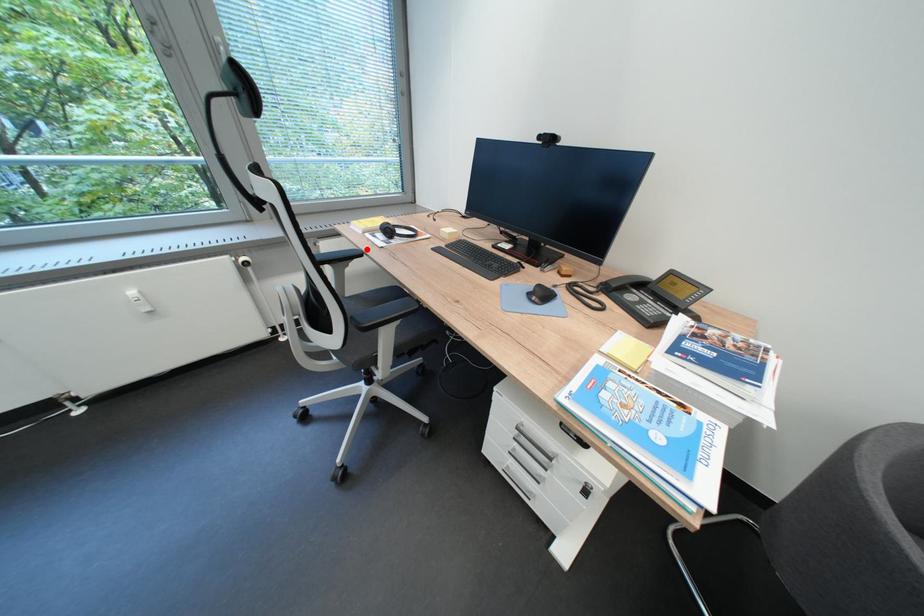
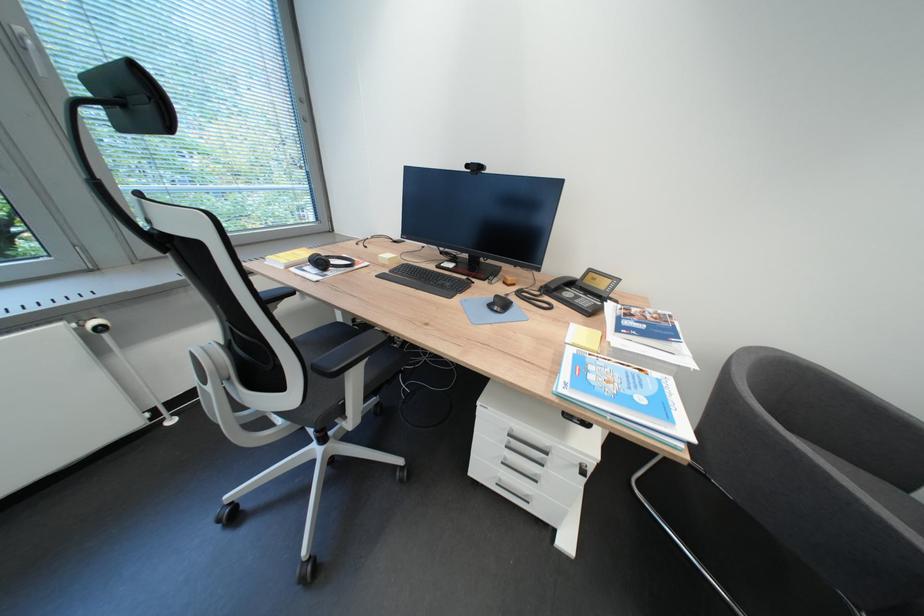
Question: I am providing you with two images of the same scene from different viewpoints. A red point is marked on the first image. At the location where the point appears in image 1, is it still visible in image 2?

Choices:
 (A) Yes
 (B) No

Answer: (A)